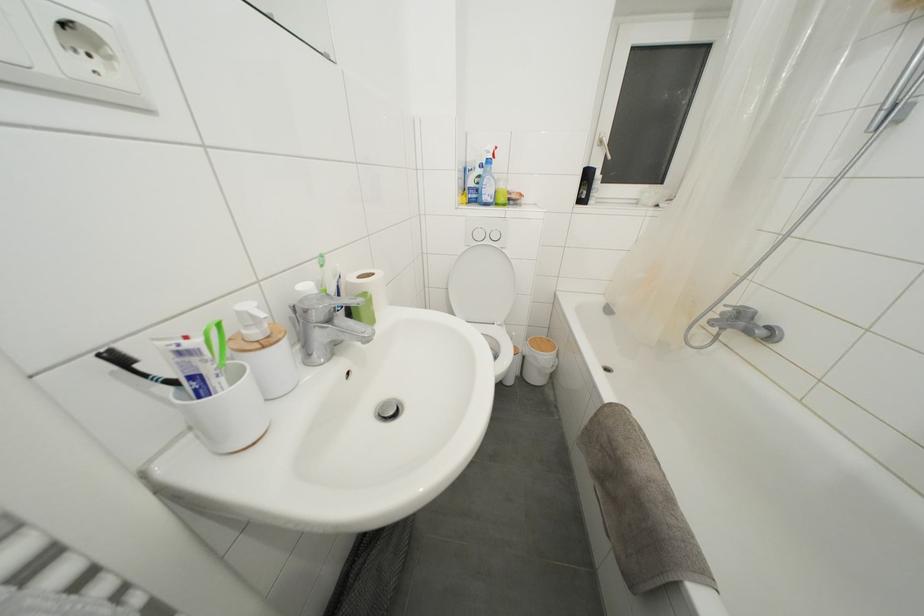
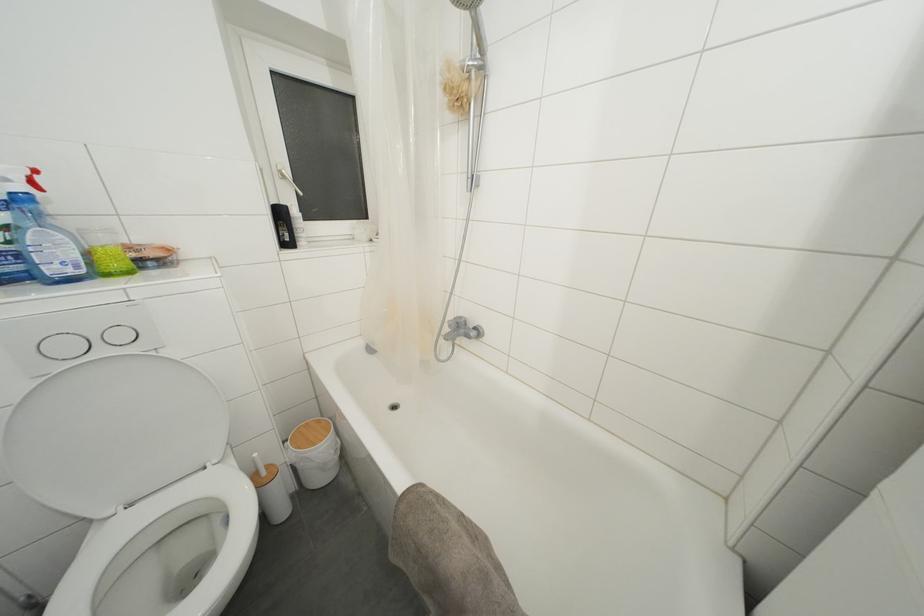
Where in the second image is the point corresponding to [544,342] from the first image?

(310, 429)